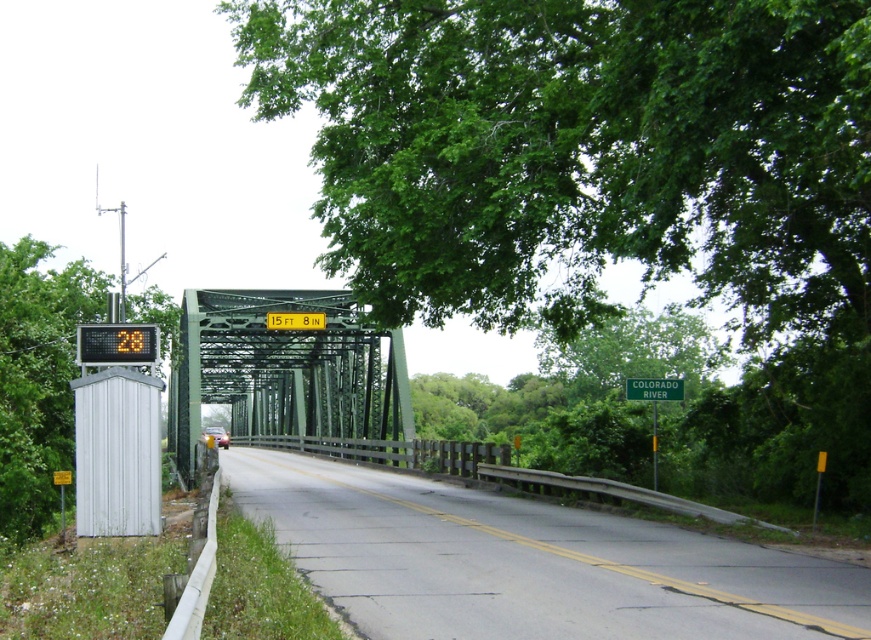
You are a driver approaching the bridge and notice the green leafy tree at center and the green plastic sign at upper center. Which object is taller?

The green leafy tree at center is taller than the green plastic sign at upper center according to the description.

You are a drone operator trying to capture the two points in the image. Which point, point (78, 326) or point (645, 381), will appear larger in the camera view?

Point (78, 326) is closer to the camera than point (645, 381), so it will appear larger in the camera view.

You are a driver approaching the metal truss bridge and need to determine the order of the points you will see first. Which point will you encounter first as you drive towards the bridge? The points are labeled as point [815,113] and point [631,378].

Point [815,113] will be encountered first because it is positioned in front of point [631,378], meaning it is closer to the driver as they approach the bridge.